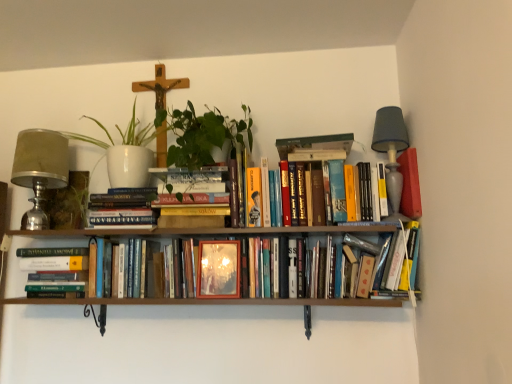
Describe the element at coordinates (123, 207) in the screenshot. I see `hardcover books at center, which appears as the 2th book when viewed from the left` at that location.

Locate an element on the screen. The width and height of the screenshot is (512, 384). matte silver table lamp at left, arranged as the 1th table lamp when viewed from the left is located at coordinates (40, 170).

The width and height of the screenshot is (512, 384). Find the location of `white ceramic pot at upper left`. white ceramic pot at upper left is located at coordinates click(125, 153).

Describe the element at coordinates (55, 270) in the screenshot. I see `hardcover book at lower left, the third book in the right-to-left sequence` at that location.

Measure the distance between point (x=81, y=272) and camera.

They are 5.09 feet apart.

What do you see at coordinates (234, 268) in the screenshot?
I see `hardcover books at center, which appears as the 1th book when viewed from the right` at bounding box center [234, 268].

You are a GUI agent. You are given a task and a screenshot of the screen. Output one action in this format:
    pyautogui.click(x=<x>, y=<y>)
    Task: Click on the gray fabric lampshade at upper right, which ranks as the 2th table lamp in left-to-right order
    The height and width of the screenshot is (384, 512).
    Given the screenshot: What is the action you would take?
    pyautogui.click(x=391, y=151)

This screenshot has width=512, height=384. I want to click on hardcover books at center, which appears as the 2th book when viewed from the left, so click(123, 207).

From the picture: From the image's perspective, is green matte vase at left positioned above or below hardcover book at lower left, the 1th book in the left-to-right sequence?

Based on their image positions, green matte vase at left is located above hardcover book at lower left, the 1th book in the left-to-right sequence.

From a real-world perspective, is green matte vase at left above or below hardcover book at lower left, the third book in the right-to-left sequence?

green matte vase at left is situated higher than hardcover book at lower left, the third book in the right-to-left sequence, in the real world.

Can you confirm if green matte vase at left is wider than hardcover book at lower left, the third book in the right-to-left sequence?

In fact, green matte vase at left might be narrower than hardcover book at lower left, the third book in the right-to-left sequence.

Based on the photo, could you tell me if matte wooden frame at center is turned towards matte silver table lamp at left, the second table lamp viewed from the right?

No, matte wooden frame at center does not turn towards matte silver table lamp at left, the second table lamp viewed from the right.

You are a GUI agent. You are given a task and a screenshot of the screen. Output one action in this format:
    pyautogui.click(x=<x>, y=<y>)
    Task: Click on the paperback book to the right of matte silver table lamp at left, the second table lamp viewed from the right
    The height and width of the screenshot is (384, 512).
    Given the screenshot: What is the action you would take?
    pyautogui.click(x=218, y=269)

In the image, is matte wooden frame at center positioned in front of or behind matte silver table lamp at left, arranged as the 1th table lamp when viewed from the left?

matte wooden frame at center is positioned closer to the viewer than matte silver table lamp at left, arranged as the 1th table lamp when viewed from the left.

Which object is positioned more to the left, matte wooden frame at center or matte silver table lamp at left, the second table lamp viewed from the right?

matte silver table lamp at left, the second table lamp viewed from the right.

At what (x,y) coordinates should I click in order to perform the action: click on book below the hardcover books at center, which appears as the 1th book when viewed from the right (from a real-world perspective). Please return your answer as a coordinate pair (x, y). Image resolution: width=512 pixels, height=384 pixels. Looking at the image, I should click on [x=55, y=270].

Who is taller, hardcover books at center, the 3th book from the left, or hardcover book at lower left, the third book in the right-to-left sequence?

With more height is hardcover books at center, the 3th book from the left.

Considering the points (212, 234) and (45, 254), which point is behind, point (212, 234) or point (45, 254)?

Point (45, 254)

How many degrees apart are the facing directions of gray fabric lampshade at upper right, which ranks as the 2th table lamp in left-to-right order, and hardcover book at lower left, the 1th book in the left-to-right sequence?

The angular difference between gray fabric lampshade at upper right, which ranks as the 2th table lamp in left-to-right order, and hardcover book at lower left, the 1th book in the left-to-right sequence, is 1.8 degrees.

Is point (392, 189) less distant than point (29, 287)?

That is True.

From a real-world perspective, is gray fabric lampshade at upper right, which ranks as the 2th table lamp in left-to-right order, above or below hardcover book at lower left, the third book in the right-to-left sequence?

gray fabric lampshade at upper right, which ranks as the 2th table lamp in left-to-right order, is situated higher than hardcover book at lower left, the third book in the right-to-left sequence, in the real world.

Could you tell me if gray fabric lampshade at upper right, the first table lamp positioned from the right, is facing hardcover book at lower left, the third book in the right-to-left sequence?

No.

Which is nearer, (55, 272) or (143, 201)?

The point (143, 201) is in front.

From a real-world perspective, who is located higher, hardcover book at lower left, the 1th book in the left-to-right sequence, or hardcover books at center, which appears as the 2th book when viewed from the left?

From a 3D spatial view, hardcover books at center, which appears as the 2th book when viewed from the left, is above.

Are hardcover book at lower left, the third book in the right-to-left sequence, and hardcover books at center, which appears as the 2th book when viewed from the left, making contact?

hardcover book at lower left, the third book in the right-to-left sequence, is not next to hardcover books at center, which appears as the 2th book when viewed from the left, and they're not touching.

Is hardcover book at lower left, the third book in the right-to-left sequence, outside of hardcover books at center, the 2th book from the right?

That's correct, hardcover book at lower left, the third book in the right-to-left sequence, is outside of hardcover books at center, the 2th book from the right.

Measure the distance between hardcover books at center, which appears as the 2th book when viewed from the left, and matte silver table lamp at left, the second table lamp viewed from the right.

A distance of 11.92 inches exists between hardcover books at center, which appears as the 2th book when viewed from the left, and matte silver table lamp at left, the second table lamp viewed from the right.

Based on the photo, is hardcover books at center, which appears as the 2th book when viewed from the left, closer to the viewer compared to matte silver table lamp at left, the second table lamp viewed from the right?

Yes, the depth of hardcover books at center, which appears as the 2th book when viewed from the left, is less than that of matte silver table lamp at left, the second table lamp viewed from the right.

From the image's perspective, which is below, hardcover books at center, which appears as the 2th book when viewed from the left, or matte silver table lamp at left, arranged as the 1th table lamp when viewed from the left?

hardcover books at center, which appears as the 2th book when viewed from the left, is shown below in the image.

Between hardcover books at center, the 2th book from the right, and matte silver table lamp at left, the second table lamp viewed from the right, which one has smaller size?

Smaller between the two is hardcover books at center, the 2th book from the right.

Between point (224, 293) and point (145, 222), which one is positioned in front?

Positioned in front is point (224, 293).

From a real-world perspective, is matte wooden frame at center below hardcover books at center, the 2th book from the right?

Yes, from a real-world perspective, matte wooden frame at center is below hardcover books at center, the 2th book from the right.

Choose the correct answer: Is matte wooden frame at center inside hardcover books at center, which appears as the 2th book when viewed from the left, or outside it?

matte wooden frame at center is not inside hardcover books at center, which appears as the 2th book when viewed from the left, it's outside.

Considering the sizes of objects matte wooden frame at center and hardcover books at center, the 2th book from the right, in the image provided, who is smaller, matte wooden frame at center or hardcover books at center, the 2th book from the right,?

matte wooden frame at center.

In order to click on plant that appears on the left of hardcover book at lower left, the 1th book in the left-to-right sequence in this screenshot , I will do `click(68, 202)`.

Identify the location of paperback book below the matte silver table lamp at left, the second table lamp viewed from the right (from the image's perspective). This screenshot has height=384, width=512. (218, 269).

Considering their positions, is white ceramic pot at upper left positioned closer to hardcover books at center, which appears as the 1th book when viewed from the right, than hardcover books at center, which appears as the 2th book when viewed from the left?

hardcover books at center, which appears as the 2th book when viewed from the left, lies closer to hardcover books at center, which appears as the 1th book when viewed from the right, than the other object.

From the picture: Estimate the real-world distances between objects in this image. Which object is closer to matte wooden frame at center, hardcover book at lower left, the 1th book in the left-to-right sequence, or white ceramic pot at upper left?

Based on the image, white ceramic pot at upper left appears to be nearer to matte wooden frame at center.

From the image, which object appears to be nearer to gray fabric lampshade at upper right, which ranks as the 2th table lamp in left-to-right order, white ceramic pot at upper left or hardcover book at lower left, the 1th book in the left-to-right sequence?

Based on the image, white ceramic pot at upper left appears to be nearer to gray fabric lampshade at upper right, which ranks as the 2th table lamp in left-to-right order.

Looking at the image, which one is located closer to hardcover books at center, which appears as the 2th book when viewed from the left, white ceramic pot at upper left or hardcover book at lower left, the 1th book in the left-to-right sequence?

white ceramic pot at upper left is positioned closer to the anchor hardcover books at center, which appears as the 2th book when viewed from the left.

Based on their spatial positions, is hardcover book at lower left, the third book in the right-to-left sequence, or gray fabric lampshade at upper right, the first table lamp positioned from the right, further from white ceramic pot at upper left?

gray fabric lampshade at upper right, the first table lamp positioned from the right, is further to white ceramic pot at upper left.

Looking at the image, which one is located closer to gray fabric lampshade at upper right, which ranks as the 2th table lamp in left-to-right order, matte silver table lamp at left, the second table lamp viewed from the right, or hardcover book at lower left, the third book in the right-to-left sequence?

Based on the image, hardcover book at lower left, the third book in the right-to-left sequence, appears to be nearer to gray fabric lampshade at upper right, which ranks as the 2th table lamp in left-to-right order.

From the image, which object appears to be farther from hardcover books at center, which appears as the 1th book when viewed from the right, green matte vase at left or gray fabric lampshade at upper right, the first table lamp positioned from the right?

gray fabric lampshade at upper right, the first table lamp positioned from the right, lies further to hardcover books at center, which appears as the 1th book when viewed from the right, than the other object.

From the image, which object appears to be nearer to hardcover book at lower left, the 1th book in the left-to-right sequence, white ceramic pot at upper left or matte wooden frame at center?

Among the two, white ceramic pot at upper left is located nearer to hardcover book at lower left, the 1th book in the left-to-right sequence.

I want to click on book between white ceramic pot at upper left and matte wooden frame at center from top to bottom, so click(x=123, y=207).

Identify the location of paperback book between white ceramic pot at upper left and hardcover books at center, the 3th book from the left, in the vertical direction. Image resolution: width=512 pixels, height=384 pixels. (218, 269).

The height and width of the screenshot is (384, 512). I want to click on paperback book between green matte vase at left and hardcover books at center, the 3th book from the left, from left to right, so click(218, 269).

Identify the location of plant between matte silver table lamp at left, the second table lamp viewed from the right, and hardcover books at center, which appears as the 1th book when viewed from the right, in the horizontal direction. This screenshot has height=384, width=512. (68, 202).